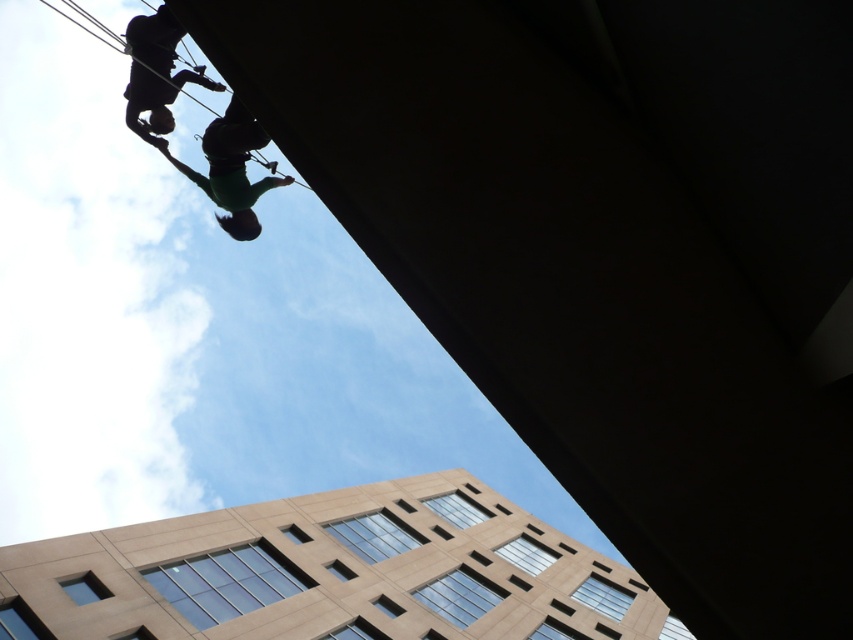
Question: Which object appears closest to the camera in this image?

Choices:
 (A) green fabric at upper center
 (B) black matte climbing harness at upper left

Answer: (A)

Question: Which point is farther from the camera taking this photo?

Choices:
 (A) (236, 134)
 (B) (169, 44)

Answer: (B)

Question: Is green fabric at upper center thinner than black matte climbing harness at upper left?

Choices:
 (A) no
 (B) yes

Answer: (A)

Question: Does green fabric at upper center have a smaller size compared to black matte climbing harness at upper left?

Choices:
 (A) yes
 (B) no

Answer: (B)

Question: Can you confirm if green fabric at upper center is positioned to the right of black matte climbing harness at upper left?

Choices:
 (A) yes
 (B) no

Answer: (A)